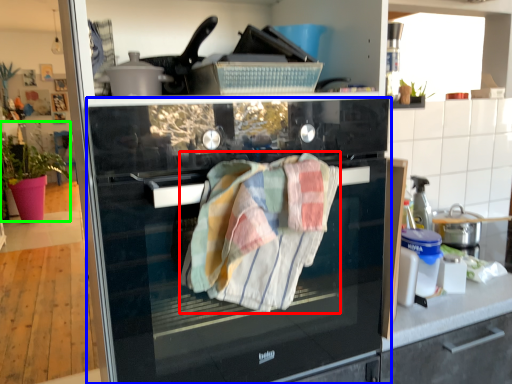
Question: Estimate the real-world distances between objects in this image. Which object is farther from bath towel (highlighted by a red box), home appliance (highlighted by a blue box) or plant (highlighted by a green box)?

Choices:
 (A) home appliance
 (B) plant

Answer: (B)